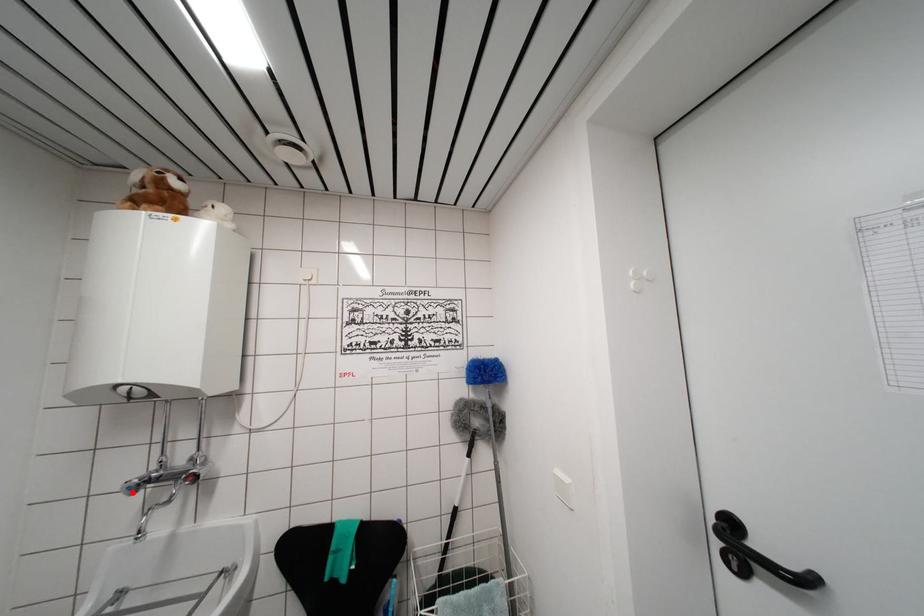
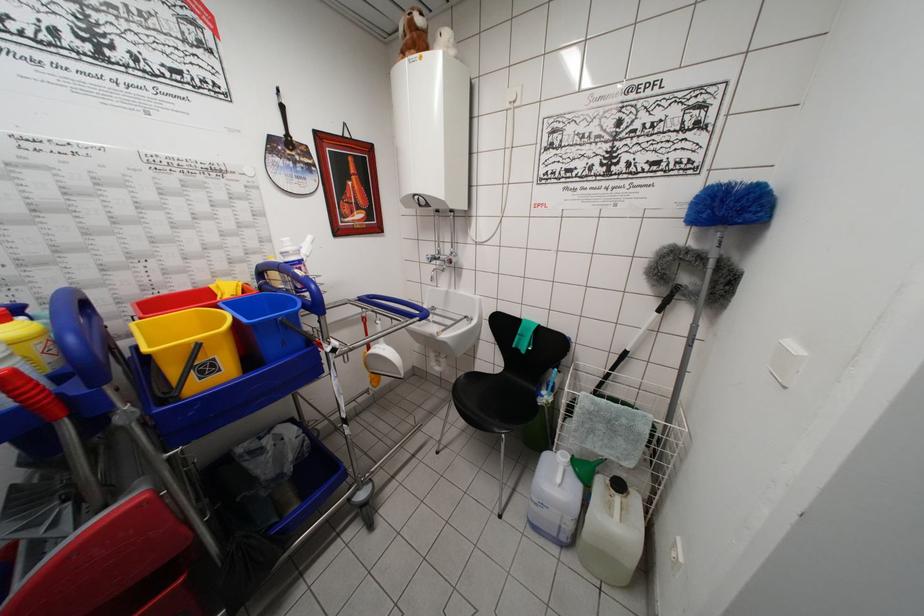
In the second image, find the point that corresponds to the highlighted location in the first image.

(432, 262)